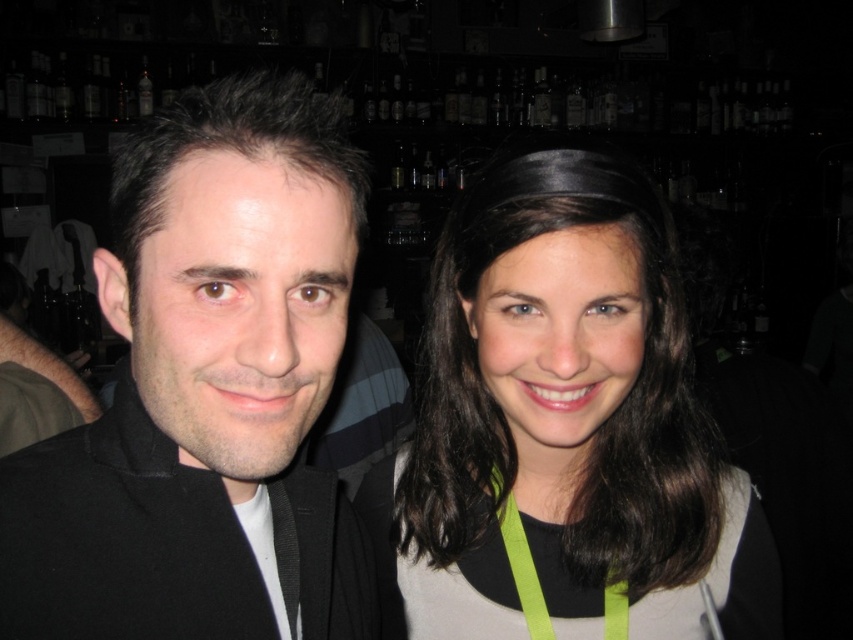
Does black matte jacket at left have a lesser height compared to green fabric lanyard at center?

Incorrect, black matte jacket at left's height does not fall short of green fabric lanyard at center's.

Is point (322, 282) positioned before point (610, 586)?

Yes, point (322, 282) is in front of point (610, 586).

The height and width of the screenshot is (640, 853). Describe the element at coordinates (206, 392) in the screenshot. I see `black matte jacket at left` at that location.

Locate an element on the screen. The height and width of the screenshot is (640, 853). black matte jacket at left is located at coordinates (206, 392).

Which is more to the left, smooth brown hair at center or green fabric lanyard at center?

green fabric lanyard at center

Who is taller, smooth brown hair at center or green fabric lanyard at center?

Standing taller between the two is smooth brown hair at center.

Who is more distant from viewer, (430, 588) or (503, 525)?

Positioned behind is point (430, 588).

Locate an element on the screen. The image size is (853, 640). smooth brown hair at center is located at coordinates (563, 429).

Does black matte jacket at left have a smaller size compared to smooth brown hair at center?

Yes.

Does black matte jacket at left come behind smooth brown hair at center?

No, it is not.

Where is `black matte jacket at left`? black matte jacket at left is located at coordinates (206, 392).